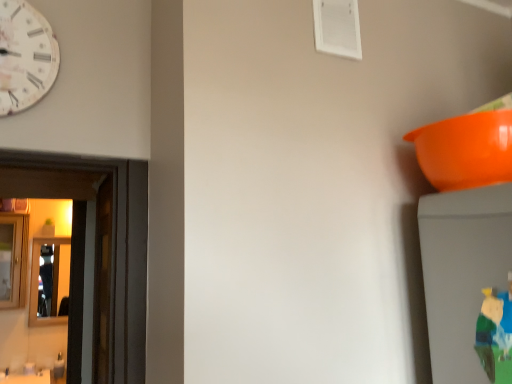
Question: Considering the relative sizes of plush green toy at lower right and white paper-like clock at upper left in the image provided, is plush green toy at lower right bigger than white paper-like clock at upper left?

Choices:
 (A) yes
 (B) no

Answer: (B)

Question: Is plush green toy at lower right to the left of white paper-like clock at upper left from the viewer's perspective?

Choices:
 (A) no
 (B) yes

Answer: (A)

Question: Could you tell me if plush green toy at lower right is facing white paper-like clock at upper left?

Choices:
 (A) no
 (B) yes

Answer: (A)

Question: Are plush green toy at lower right and white paper-like clock at upper left located far from each other?

Choices:
 (A) yes
 (B) no

Answer: (A)

Question: Is white paper-like clock at upper left located within plush green toy at lower right?

Choices:
 (A) yes
 (B) no

Answer: (B)

Question: Is plush green toy at lower right wider than white paper-like clock at upper left?

Choices:
 (A) yes
 (B) no

Answer: (B)

Question: Considering the relative sizes of shiny silver mirror at left, which appears as the 2th mirror when viewed from the front, and white paper-like clock at upper left in the image provided, is shiny silver mirror at left, which appears as the 2th mirror when viewed from the front, smaller than white paper-like clock at upper left?

Choices:
 (A) yes
 (B) no

Answer: (B)

Question: Is shiny silver mirror at left, which appears as the 2th mirror when viewed from the front, aimed at white paper-like clock at upper left?

Choices:
 (A) no
 (B) yes

Answer: (B)

Question: Does shiny silver mirror at left, which appears as the 2th mirror when viewed from the front, have a lesser height compared to white paper-like clock at upper left?

Choices:
 (A) yes
 (B) no

Answer: (B)

Question: Does shiny silver mirror at left, the first mirror positioned from the back, touch white paper-like clock at upper left?

Choices:
 (A) no
 (B) yes

Answer: (A)

Question: Is shiny silver mirror at left, the first mirror positioned from the back, positioned far away from white paper-like clock at upper left?

Choices:
 (A) no
 (B) yes

Answer: (B)

Question: From a real-world perspective, is shiny silver mirror at left, which appears as the 2th mirror when viewed from the front, over white paper-like clock at upper left?

Choices:
 (A) yes
 (B) no

Answer: (B)

Question: Could you tell me if shiny silver mirror at left, which appears as the 2th mirror when viewed from the front, is facing orange plastic bowl at upper right?

Choices:
 (A) yes
 (B) no

Answer: (B)